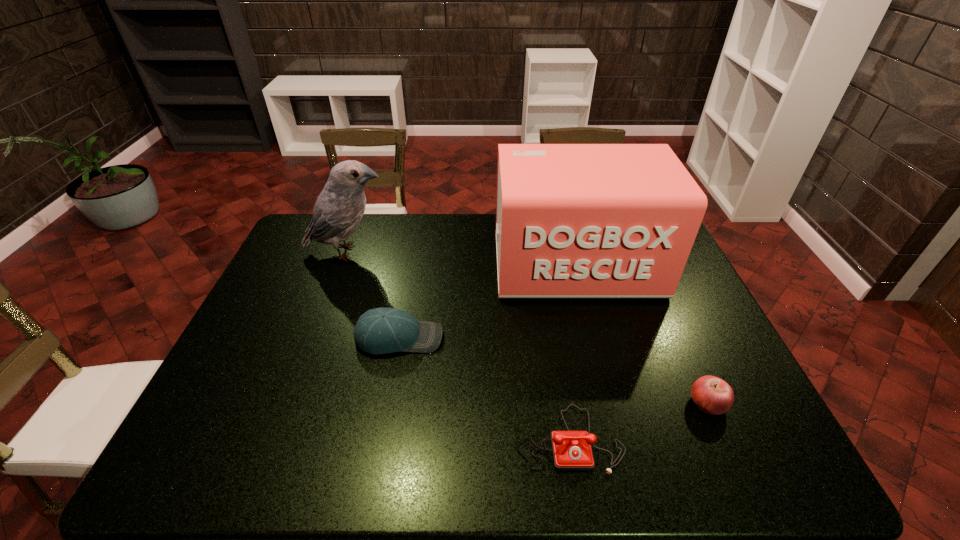
What are the coordinates of `box` in the screenshot? It's located at (572, 220).

At what (x,y) coordinates should I click in order to perform the action: click on parrot. Please return your answer as a coordinate pair (x, y). The height and width of the screenshot is (540, 960). Looking at the image, I should click on (339, 208).

Where is `baseball cap`? The width and height of the screenshot is (960, 540). baseball cap is located at coordinates (381, 330).

Locate an element on the screen. apple is located at coordinates (712, 395).

At what (x,y) coordinates should I click in order to perform the action: click on the shortest object. Please return your answer as a coordinate pair (x, y). Image resolution: width=960 pixels, height=540 pixels. Looking at the image, I should click on (571, 450).

The height and width of the screenshot is (540, 960). In order to click on vacant space situated on the surface of the box where the text is embossed in this screenshot , I will do `click(606, 381)`.

The width and height of the screenshot is (960, 540). What are the coordinates of `blank area located 0.240m on the front-facing side of the parrot` in the screenshot? It's located at (461, 252).

Where is `vacant region located 0.110m on the front of the baseball cap`? This screenshot has width=960, height=540. vacant region located 0.110m on the front of the baseball cap is located at coordinates (389, 392).

Where is `vacant area situated on the left of the apple`? vacant area situated on the left of the apple is located at coordinates (668, 403).

I want to click on box at the far edge, so click(x=572, y=220).